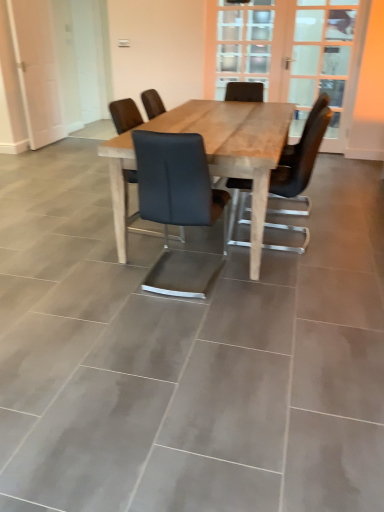
Question: Which direction should I rotate to look at clear glass door at upper center, positioned as the first screen door in right-to-left order?

Choices:
 (A) left
 (B) right

Answer: (B)

Question: From the image's perspective, would you say matte black chair at center, the first chair viewed from the right, is shown under clear glass door at upper center?

Choices:
 (A) no
 (B) yes

Answer: (B)

Question: Is matte black chair at center, placed as the third chair when sorted from left to right, to the left of clear glass door at upper center from the viewer's perspective?

Choices:
 (A) yes
 (B) no

Answer: (A)

Question: Considering the relative sizes of matte black chair at center, placed as the third chair when sorted from left to right, and clear glass door at upper center in the image provided, is matte black chair at center, placed as the third chair when sorted from left to right, smaller than clear glass door at upper center?

Choices:
 (A) yes
 (B) no

Answer: (B)

Question: Considering the relative sizes of matte black chair at center, placed as the third chair when sorted from left to right, and clear glass door at upper center in the image provided, is matte black chair at center, placed as the third chair when sorted from left to right, thinner than clear glass door at upper center?

Choices:
 (A) yes
 (B) no

Answer: (B)

Question: Can you confirm if matte black chair at center, placed as the third chair when sorted from left to right, is wider than clear glass door at upper center?

Choices:
 (A) no
 (B) yes

Answer: (B)

Question: Is matte black chair at center, placed as the third chair when sorted from left to right, closer to the viewer compared to matte black chair at center, marked as the 3th chair in a right-to-left arrangement?

Choices:
 (A) no
 (B) yes

Answer: (B)

Question: Is matte black chair at center, placed as the 1th chair when sorted from left to right, at the back of matte black chair at center, placed as the third chair when sorted from left to right?

Choices:
 (A) no
 (B) yes

Answer: (A)

Question: From the image's perspective, is matte black chair at center, the first chair viewed from the right, located beneath matte black chair at center, placed as the 1th chair when sorted from left to right?

Choices:
 (A) yes
 (B) no

Answer: (A)

Question: Can we say matte black chair at center, the first chair viewed from the right, lies outside matte black chair at center, placed as the 1th chair when sorted from left to right?

Choices:
 (A) yes
 (B) no

Answer: (A)

Question: From a real-world perspective, does matte black chair at center, the first chair viewed from the right, stand above matte black chair at center, placed as the 1th chair when sorted from left to right?

Choices:
 (A) yes
 (B) no

Answer: (A)

Question: Is matte black chair at center, placed as the third chair when sorted from left to right, thinner than matte black chair at center, placed as the 1th chair when sorted from left to right?

Choices:
 (A) no
 (B) yes

Answer: (A)

Question: Does natural wood table at center come behind clear glass door at upper center, positioned as the first screen door in right-to-left order?

Choices:
 (A) yes
 (B) no

Answer: (B)